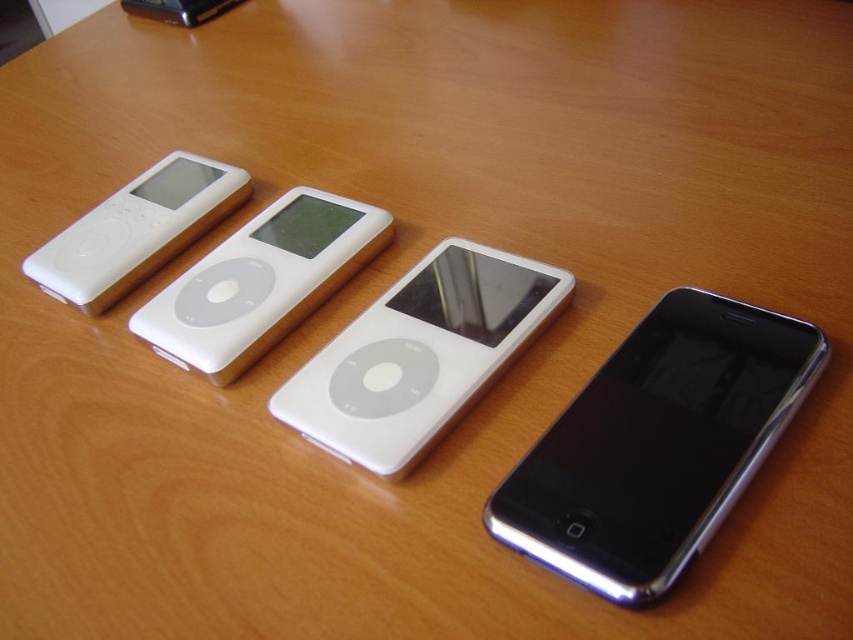
You are standing in front of the wooden surface with the four electronic devices. You need to place a new device between the two points marked as point (630,426) and point (469,276). Which point should the new device be closer to in order to maintain the existing arrangement?

The new device should be placed closer to point (469,276) because point (630,426) is in front of point (469,276), so maintaining the arrangement requires positioning the new device behind point (630,426) towards point (469,276).

You are organizing these iPods on a shelf. If you want to arrange them from tallest to shortest, where should the white glossy iPod at center be placed relative to the white glossy iPod at left?

The white glossy iPod at center is shorter than the white glossy iPod at left, so it should be placed after the white glossy iPod at left in the arrangement from tallest to shortest.

You are organizing a display of vintage electronics and need to place a new label between the white glossy ipod at center and the white glossy ipod at left. The label requires 6 inches of space. Based on the image, will there be enough space for the label between these two iPods?

The white glossy ipod at center and white glossy ipod at left are 7.39 inches apart, which is more than the required 6 inches. Therefore, there is sufficient space to place the label between them.